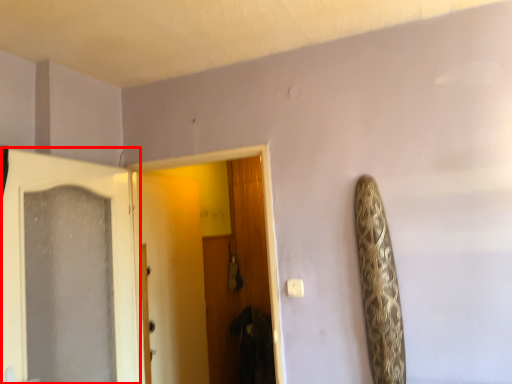
Question: From the image's perspective, what is the correct spatial relationship of door (annotated by the red box) in relation to door?

Choices:
 (A) below
 (B) above

Answer: (A)